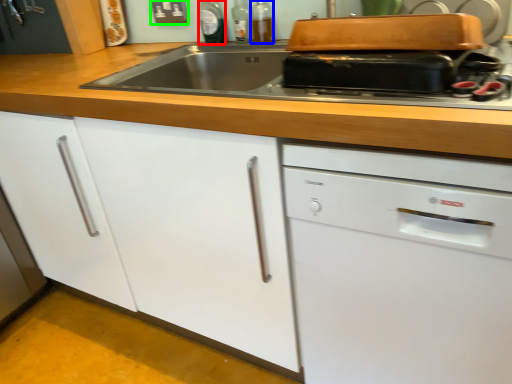
Question: Which is farther away from bottle (highlighted by a red box)? bottle (highlighted by a blue box) or electric outlet (highlighted by a green box)?

Choices:
 (A) bottle
 (B) electric outlet

Answer: (A)